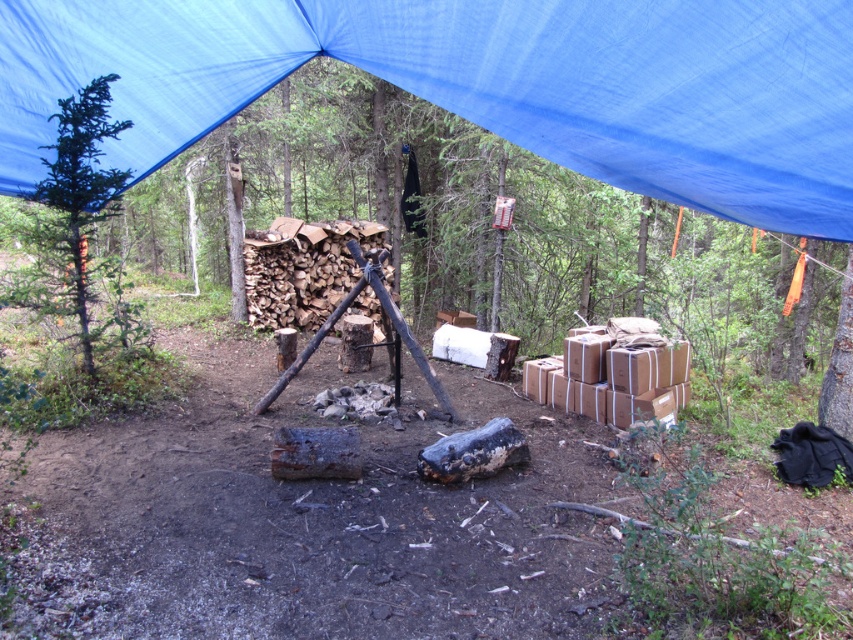
Which is in front, point (583, 1) or point (47, 164)?

Point (583, 1) is more forward.

This screenshot has height=640, width=853. I want to click on blue fabric canopy at upper center, so click(482, 84).

At what (x,y) coordinates should I click in order to perform the action: click on blue fabric canopy at upper center. Please return your answer as a coordinate pair (x, y). Looking at the image, I should click on (482, 84).